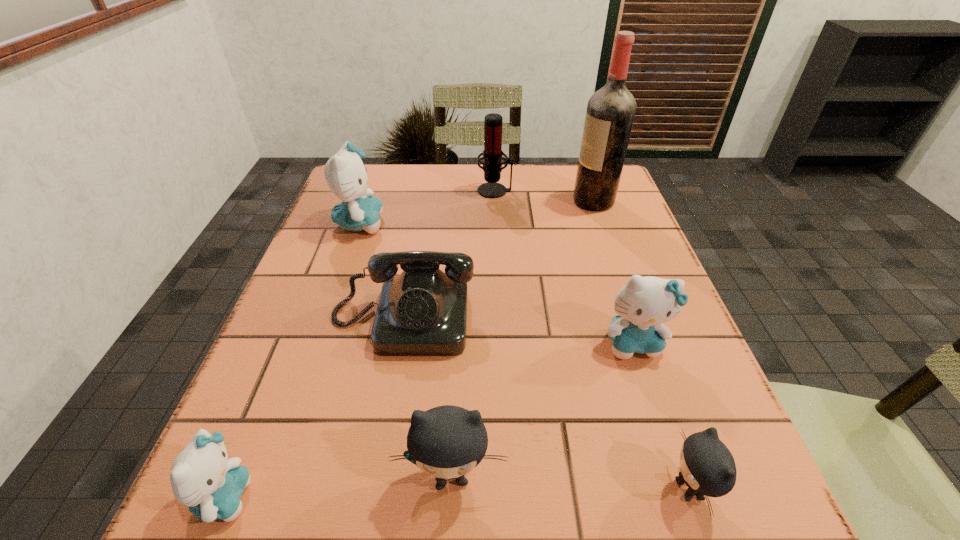
Find the location of a particular element. This screenshot has width=960, height=540. the smaller gray kitten is located at coordinates (707, 467).

You are a GUI agent. You are given a task and a screenshot of the screen. Output one action in this format:
    pyautogui.click(x=<x>, y=<y>)
    Task: Click on the vacant area situated on the front-facing side of the liquor
    
    Given the screenshot: What is the action you would take?
    pyautogui.click(x=481, y=201)

Find the location of a particular element. The width and height of the screenshot is (960, 540). free space located 0.160m on the front-facing side of the liquor is located at coordinates (512, 201).

Where is `blank space located on the front-facing side of the liquor`? blank space located on the front-facing side of the liquor is located at coordinates (550, 201).

Identify the location of free space located 0.300m on the right of the red microphone. (624, 191).

Locate an element on the screen. This screenshot has height=540, width=960. free point located on the face of the farthest blue kitten is located at coordinates (413, 223).

At what (x,y) coordinates should I click in order to perform the action: click on free spot located on the face of the fourth nearest kitten. Please return your answer as a coordinate pair (x, y). This screenshot has height=540, width=960. Looking at the image, I should click on (660, 422).

The height and width of the screenshot is (540, 960). What are the coordinates of `free region located on the dial of the telephone` in the screenshot? It's located at (373, 484).

You are a GUI agent. You are given a task and a screenshot of the screen. Output one action in this format:
    pyautogui.click(x=<x>, y=<y>)
    Task: Click on the free space located on the face of the nearest blue kitten
    This screenshot has width=960, height=540.
    Given the screenshot: What is the action you would take?
    pyautogui.click(x=427, y=497)

Find the location of `free space located on the front-facing side of the smaller gray kitten`. free space located on the front-facing side of the smaller gray kitten is located at coordinates (530, 489).